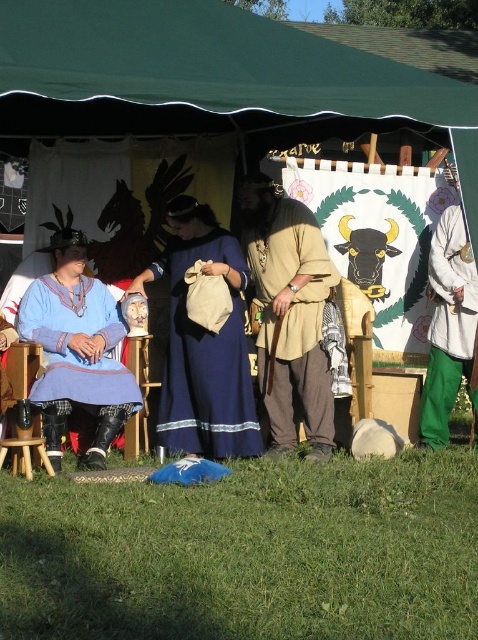
You are a photographer planning to take a group photo of the people under the green canopy tent. You need to position yourself so that the blue cotton dress at center and the matte blue tunic at left are both in frame. Given that your camera has a 24 inch field of view, will you be able to capture both subjects comfortably?

The distance between the blue cotton dress at center and the matte blue tunic at left is 24.35 inches. Since the camera has a 24 inch field of view, the subjects are slightly beyond the camera range. You may need to step back or use a wider lens to ensure both are in frame.

You are organizing a historical fashion show and need to arrange the outfits by their thickness. Which of the two outfits, the blue cotton dress at center or the matte blue tunic at left, should be placed first if you are arranging from thinnest to thickest?

The blue cotton dress at center should be placed first in the arrangement since it is thinner than the matte blue tunic at left.

Consider the image. You are a costume designer attending a historical reenactment event. You need to place a 12 inch wide decorative cloth between the beige leather tunic at center and the blue cotton dress at center. Is there enough space between them to fit the cloth?

The beige leather tunic at center and blue cotton dress at center are 15.63 inches apart from each other. Since the decorative cloth is 12 inches wide, there is enough space between them to fit the cloth.